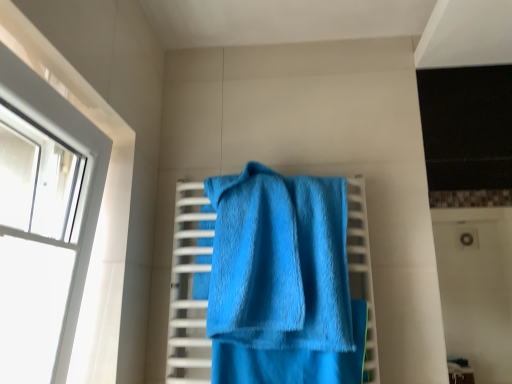
This screenshot has height=384, width=512. Identify the location of blue terry cloth towel at center. (279, 261).

This screenshot has height=384, width=512. Describe the element at coordinates (279, 261) in the screenshot. I see `blue terry cloth towel at center` at that location.

Find the location of a particular element. This screenshot has height=384, width=512. blue terry cloth towel at center is located at coordinates (279, 261).